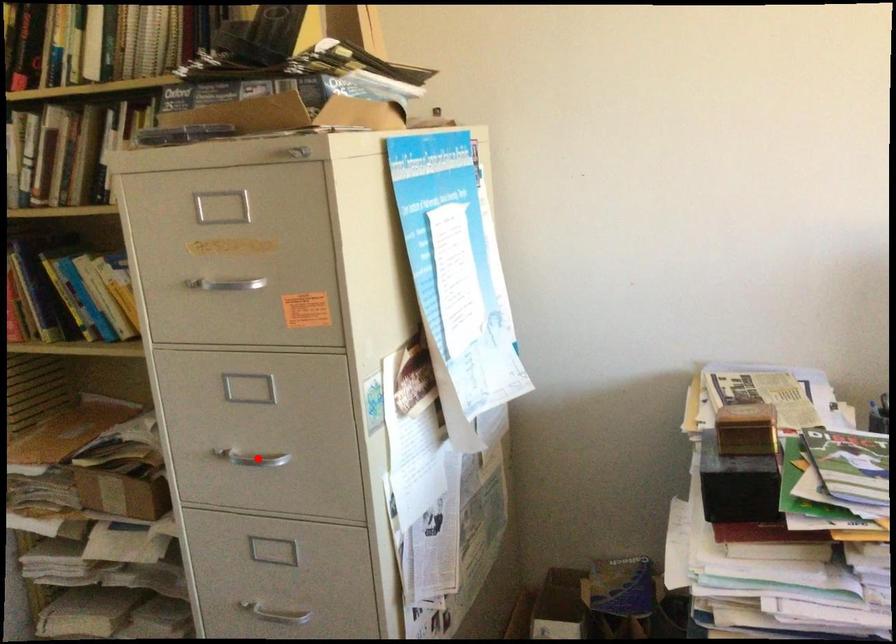
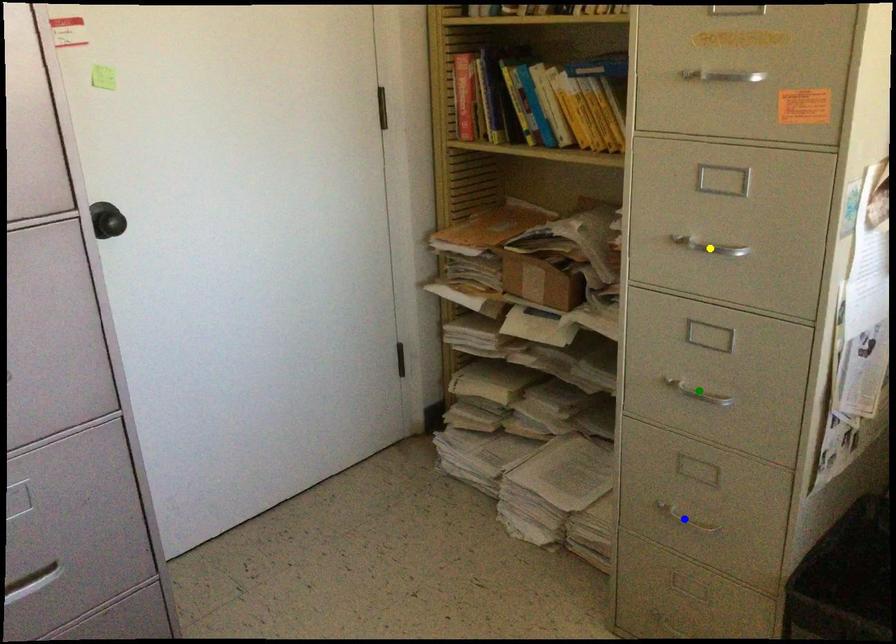
Question: I am providing you with two images of the same scene from different viewpoints. A red point is marked on the first image. You are given multiple points on the second image. In image 2, which mark is for the same physical point as the one in image 1?

Choices:
 (A) blue point
 (B) green point
 (C) yellow point

Answer: (C)